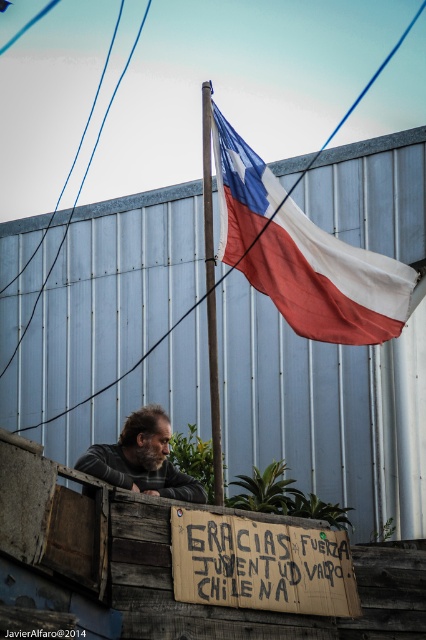
Question: Does brown cardboard sign at center have a greater width compared to gray fabric shirt at lower left?

Choices:
 (A) yes
 (B) no

Answer: (A)

Question: Which point appears farthest from the camera in this image?

Choices:
 (A) (290, 214)
 (B) (210, 342)
 (C) (89, 460)
 (D) (187, 550)

Answer: (A)

Question: Among these objects, which one is nearest to the camera?

Choices:
 (A) red-white-blue fabric flag at upper center
 (B) gray fabric shirt at lower left
 (C) wooden pole at upper center
 (D) brown cardboard sign at center

Answer: (D)

Question: Can you confirm if brown cardboard sign at center is thinner than gray fabric shirt at lower left?

Choices:
 (A) yes
 (B) no

Answer: (B)

Question: Estimate the real-world distances between objects in this image. Which object is closer to the brown cardboard sign at center?

Choices:
 (A) gray fabric shirt at lower left
 (B) red-white-blue fabric flag at upper center
 (C) wooden pole at upper center

Answer: (A)

Question: In this image, where is red-white-blue fabric flag at upper center located relative to brown cardboard sign at center?

Choices:
 (A) above
 (B) below

Answer: (A)